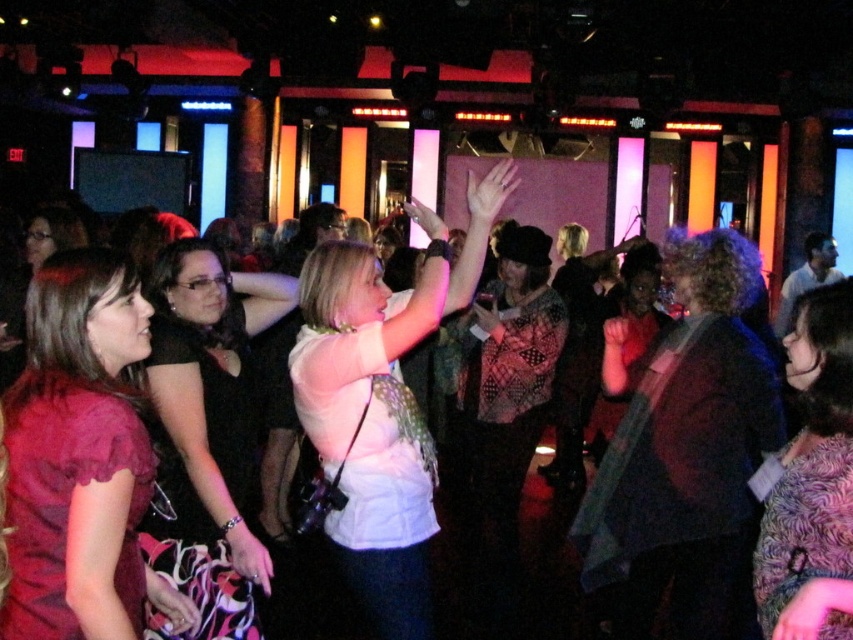
Question: Does dark brown textured jacket at center lie in front of matte red dress at left?

Choices:
 (A) no
 (B) yes

Answer: (A)

Question: Based on their relative distances, which object is nearer to the matte red dress at left?

Choices:
 (A) white matte shirt at center
 (B) fuzzy pink sweater at lower right

Answer: (A)

Question: Which is farther from the dark brown textured jacket at center?

Choices:
 (A) fuzzy pink sweater at lower right
 (B) black satin dress at center
 (C) matte red dress at left

Answer: (C)

Question: Considering the real-world distances, which object is farthest from the white matte shirt at center?

Choices:
 (A) matte red dress at left
 (B) fuzzy pink sweater at lower right

Answer: (B)

Question: Is matte red dress at left smaller than white matte shirt at center?

Choices:
 (A) yes
 (B) no

Answer: (A)

Question: Can you confirm if dark brown textured jacket at center is wider than white matte shirt at center?

Choices:
 (A) yes
 (B) no

Answer: (B)